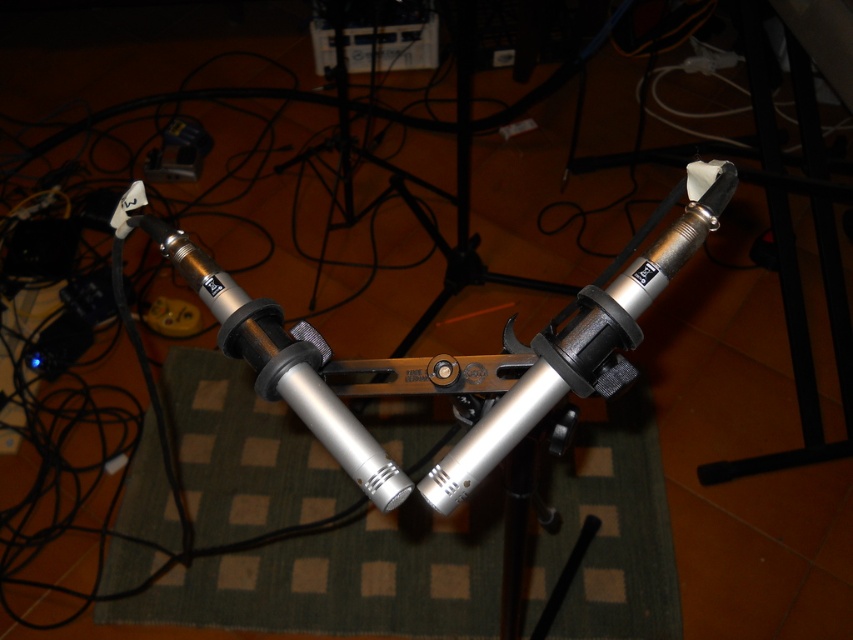
Question: Which point is closer to the camera?

Choices:
 (A) green woven mat at center
 (B) silver metallic tripod at center

Answer: (A)

Question: Observing the image, what is the correct spatial positioning of green woven mat at center in reference to silver metallic tripod at center?

Choices:
 (A) right
 (B) left

Answer: (A)

Question: Does green woven mat at center come behind silver metallic tripod at center?

Choices:
 (A) yes
 (B) no

Answer: (B)

Question: Does green woven mat at center have a lesser width compared to silver metallic tripod at center?

Choices:
 (A) yes
 (B) no

Answer: (B)

Question: Which point appears farthest from the camera in this image?

Choices:
 (A) (323, 451)
 (B) (331, 196)

Answer: (B)

Question: Which point is closer to the camera taking this photo?

Choices:
 (A) (422, 221)
 (B) (549, 458)

Answer: (B)